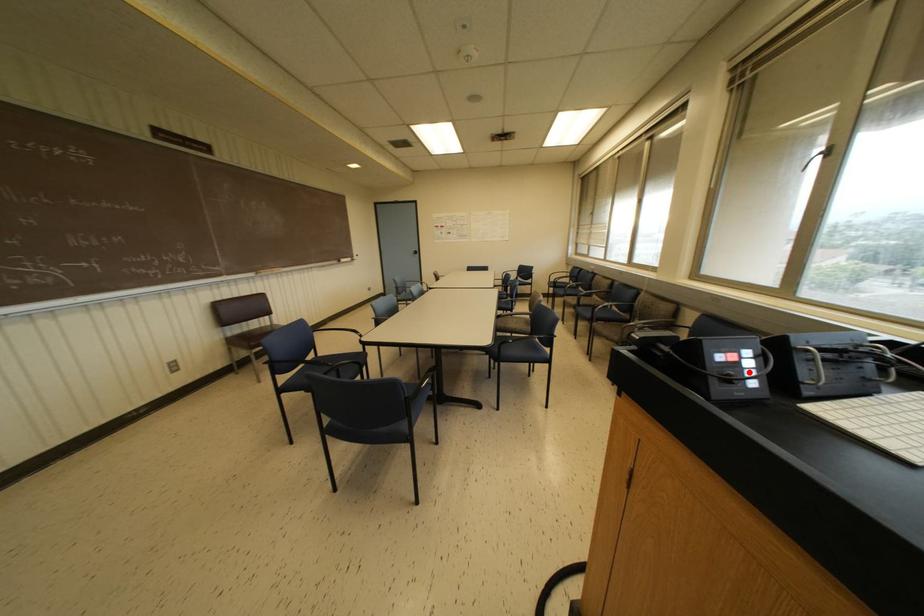
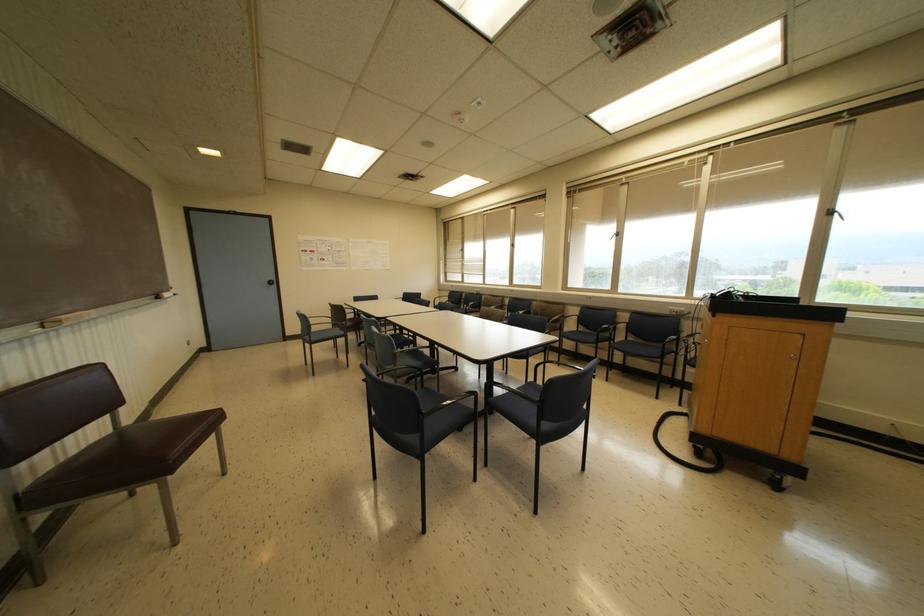
Question: I am providing you with two images of the same scene from different viewpoints. A red point is marked on the first image. At the location where the point appears in image 1, is it still visible in image 2?

Choices:
 (A) Yes
 (B) No

Answer: (B)